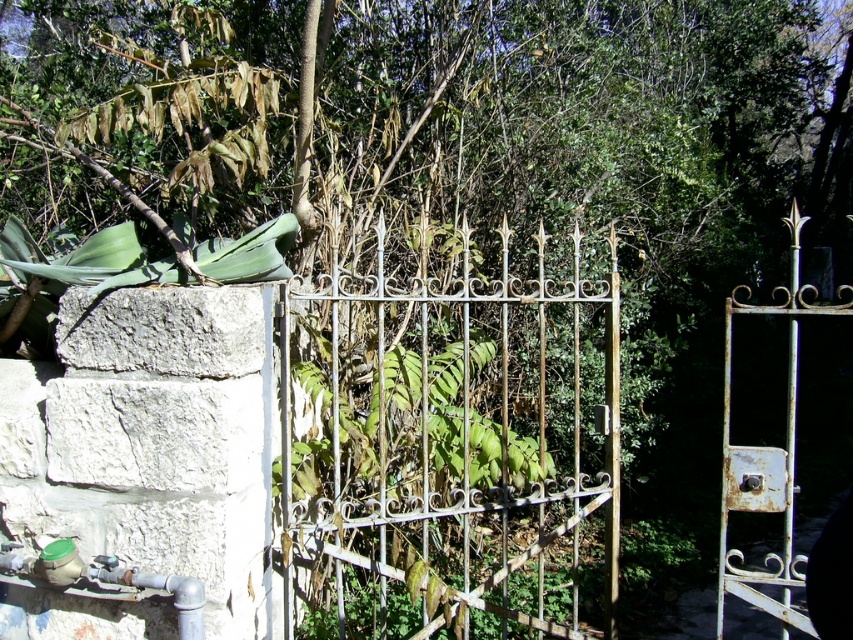
Can you confirm if rusty metal gate at center is positioned to the left of rusty metal gate at right?

Yes, rusty metal gate at center is to the left of rusty metal gate at right.

Between rusty metal gate at center and rusty metal gate at right, which one has less height?

rusty metal gate at right is shorter.

Between point (552, 385) and point (762, 465), which one is positioned behind?

Point (552, 385)

You are a GUI agent. You are given a task and a screenshot of the screen. Output one action in this format:
    pyautogui.click(x=<x>, y=<y>)
    Task: Click on the rusty metal gate at center
    The width and height of the screenshot is (853, 640).
    Given the screenshot: What is the action you would take?
    pyautogui.click(x=448, y=445)